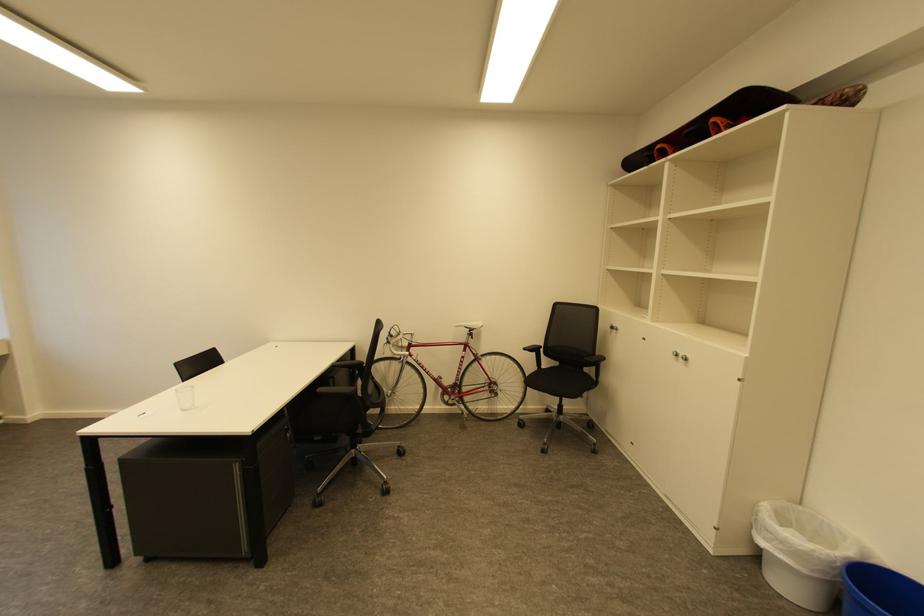
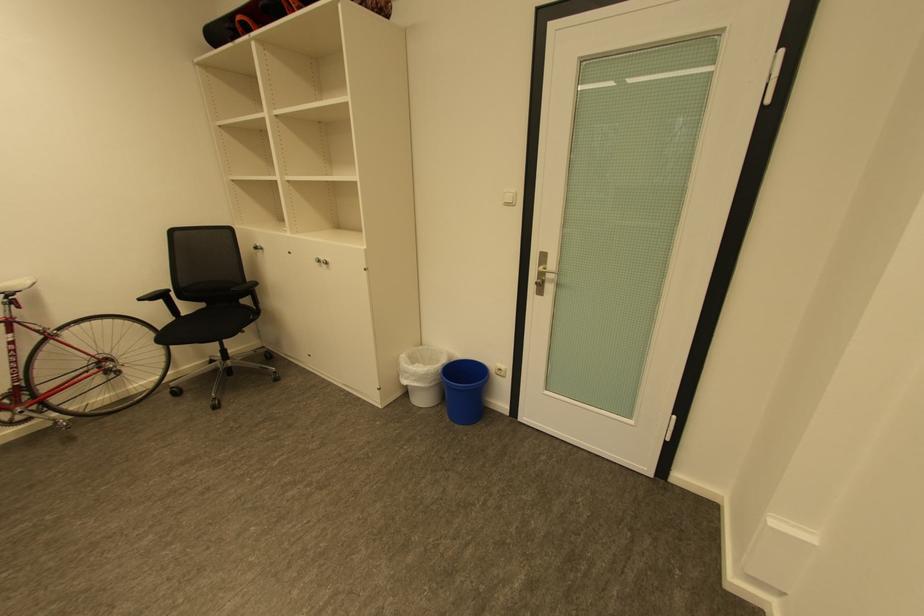
The point at [551,368] is marked in the first image. Where is the corresponding point in the second image?

(190, 315)